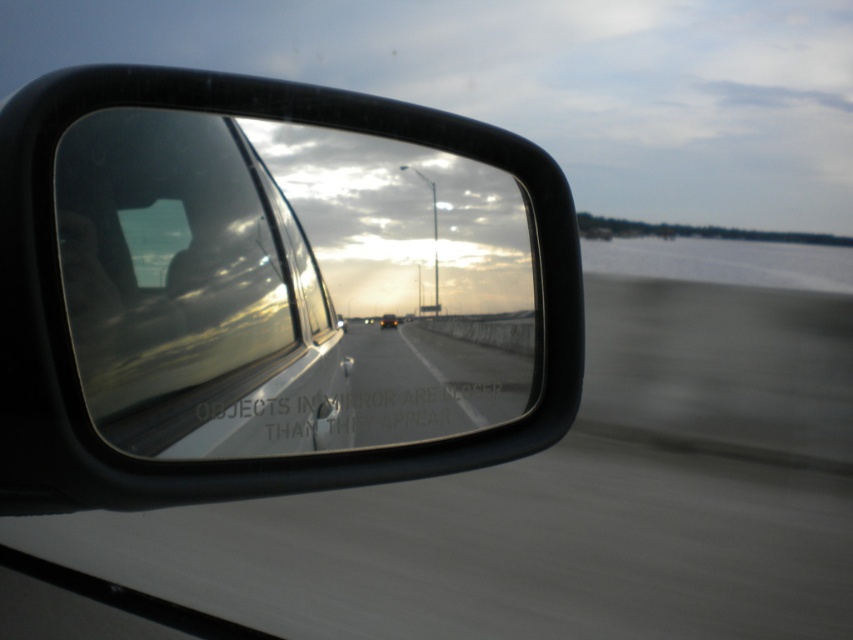
You are driving a matte black car at center and want to check your surroundings using the black plastic rearview mirror at upper left. Can you see the road ahead clearly through the mirror?

The black plastic rearview mirror at upper left is in front of the matte black car at center, so it is positioned in a way that allows the driver to see the road ahead through the mirror.

You are driving a car and want to check the position of the black plastic rearview mirror at upper left. Where exactly is it located in the frame?

The black plastic rearview mirror at upper left is located at point (x=270, y=291) in the frame.